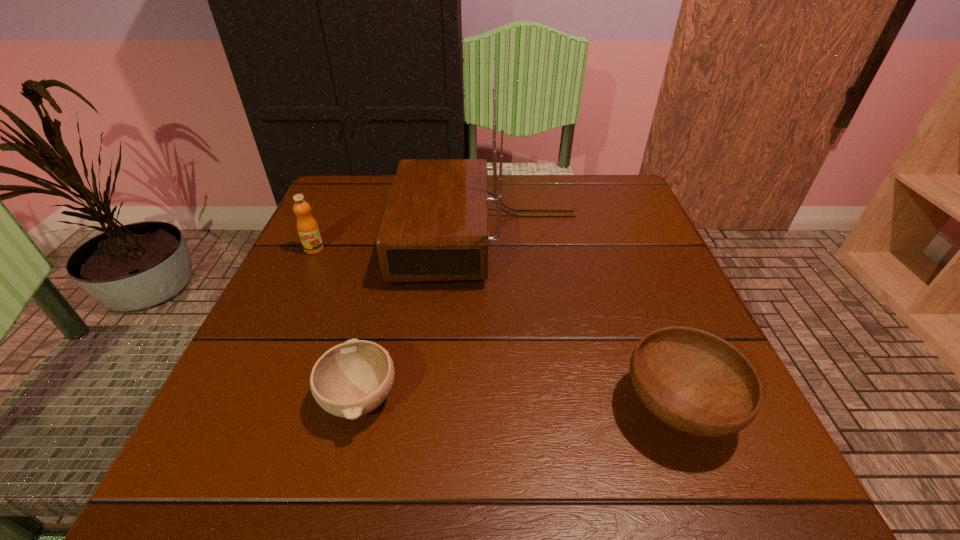
I want to click on blank region between the radio_receiver and the second shortest object, so click(584, 322).

Where is `unoccupied position between the tallest object and the taller bowl`? The height and width of the screenshot is (540, 960). unoccupied position between the tallest object and the taller bowl is located at coordinates (584, 322).

This screenshot has height=540, width=960. I want to click on vacant space that's between the leftmost object and the taller bowl, so click(496, 328).

Locate an element on the screen. This screenshot has width=960, height=540. blank region between the taller bowl and the tallest object is located at coordinates (584, 322).

Identify the location of empty space between the tallest object and the left bowl. This screenshot has width=960, height=540. (424, 317).

Find the location of a particular element. object that is the second closest to the left bowl is located at coordinates (307, 227).

Select which object appears as the third closest to the radio_receiver. Please provide its 2D coordinates. Your answer should be formatted as a tuple, i.e. [(x, y)], where the tuple contains the x and y coordinates of a point satisfying the conditions above.

[(694, 381)]

You are a GUI agent. You are given a task and a screenshot of the screen. Output one action in this format:
    pyautogui.click(x=<x>, y=<y>)
    Task: Click on the blank space that satisfies the following two spatial constraints: 1. on the front panel of the tallest object; 2. on the front side of the shorter bowl
    
    Given the screenshot: What is the action you would take?
    pyautogui.click(x=493, y=398)

Identify the location of free space that satisfies the following two spatial constraints: 1. on the front label of the shortest object; 2. on the right side of the leftmost object. (245, 398).

At what (x,y) coordinates should I click in order to perform the action: click on vacant space that satisfies the following two spatial constraints: 1. on the front label of the shortest object; 2. on the right side of the orange juice. Please return your answer as a coordinate pair (x, y). The height and width of the screenshot is (540, 960). Looking at the image, I should click on (245, 398).